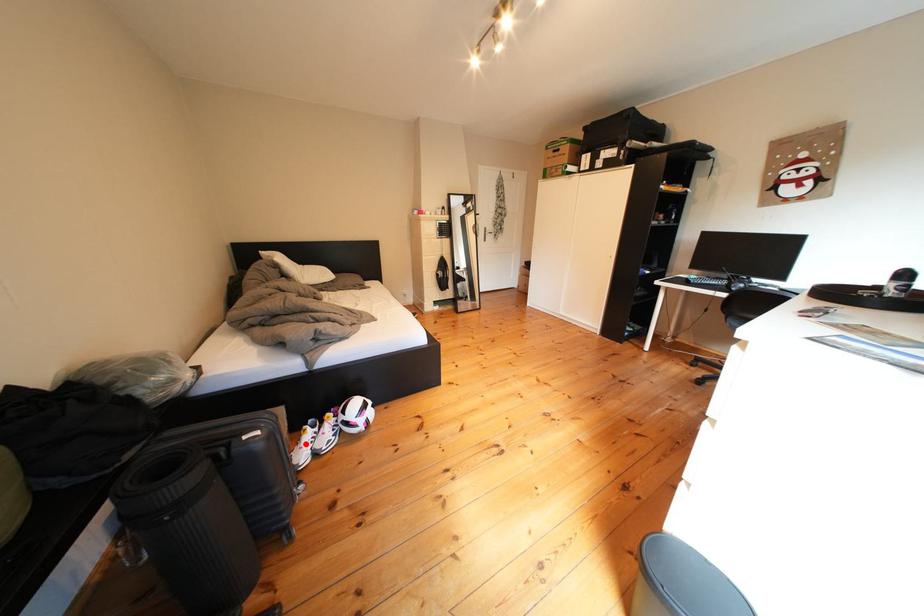
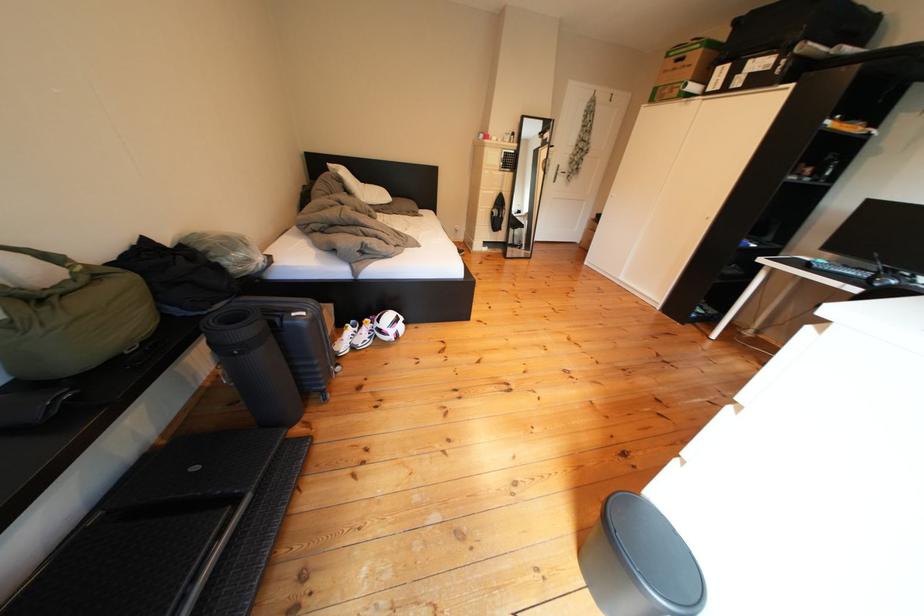
The point at the highlighted location is marked in the first image. Where is the corresponding point in the second image?

(350, 338)